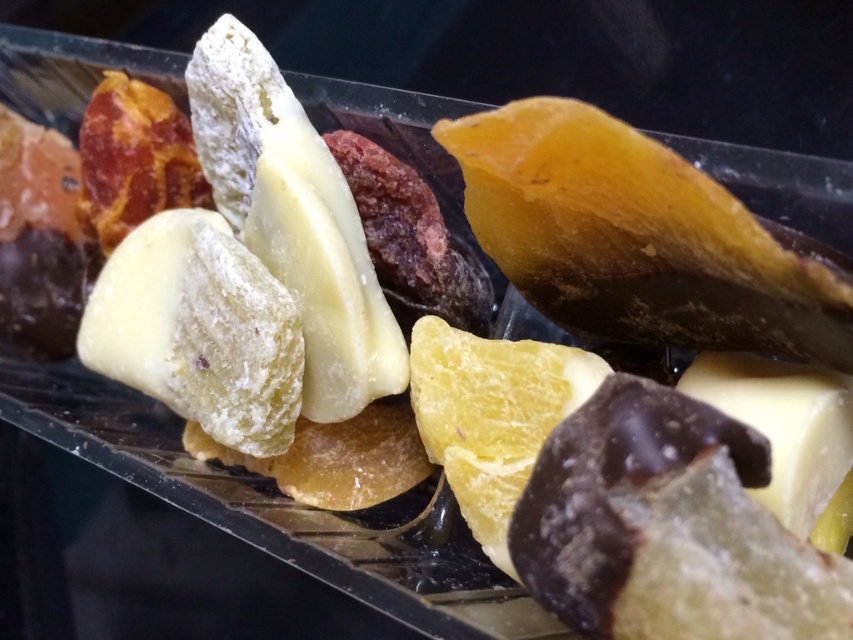
Question: Can you confirm if white powdery cheese at center is positioned above white crumbly cheese at center?

Choices:
 (A) yes
 (B) no

Answer: (A)

Question: Which object appears farthest from the camera in this image?

Choices:
 (A) white creamy cheese at lower right
 (B) white crumbly cheese at center

Answer: (B)

Question: Which of the following is the farthest from the observer?

Choices:
 (A) white powdery cheese at center
 (B) white crumbly cheese at center

Answer: (A)

Question: Estimate the real-world distances between objects in this image. Which object is closer to the white creamy cheese at lower right?

Choices:
 (A) white crumbly cheese at center
 (B) white powdery cheese at center

Answer: (B)

Question: Is white powdery cheese at center further to the viewer compared to white crumbly cheese at center?

Choices:
 (A) no
 (B) yes

Answer: (B)

Question: Is white crumbly cheese at center bigger than white creamy cheese at lower right?

Choices:
 (A) no
 (B) yes

Answer: (B)